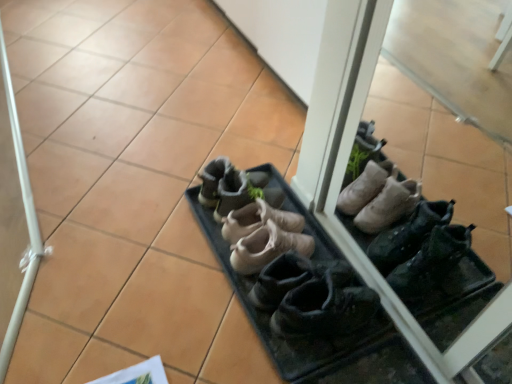
Question: Based on their positions, is black leather shoes at center, arranged as the 5th footwear when viewed from the back, located to the left or right of tan suede shoes at center, which ranks as the 3th footwear in back-to-front order?

Choices:
 (A) left
 (B) right

Answer: (B)

Question: Considering their positions, is black leather shoes at center, arranged as the 5th footwear when viewed from the back, located in front of or behind tan suede shoes at center, which ranks as the 3th footwear in back-to-front order?

Choices:
 (A) behind
 (B) front

Answer: (B)

Question: Which of these objects is positioned farthest from the tan suede shoes at center, the 3th footwear viewed from the front?

Choices:
 (A) leather boots at center, the fourth footwear when ordered from back to front
 (B) leather boots at center, arranged as the second footwear when viewed from the back
 (C) leather boots at center, the 5th footwear in the front-to-back sequence
 (D) black leather shoes at center, arranged as the 5th footwear when viewed from the back

Answer: (D)

Question: Based on their relative distances, which object is farther from the black leather shoes at center, arranged as the 5th footwear when viewed from the back?

Choices:
 (A) leather boots at center, the fourth footwear when ordered from back to front
 (B) tan suede shoes at center, the 3th footwear viewed from the front
 (C) leather boots at center, the fourth footwear viewed from the front
 (D) leather boots at center, which appears as the first footwear when viewed from the back

Answer: (D)